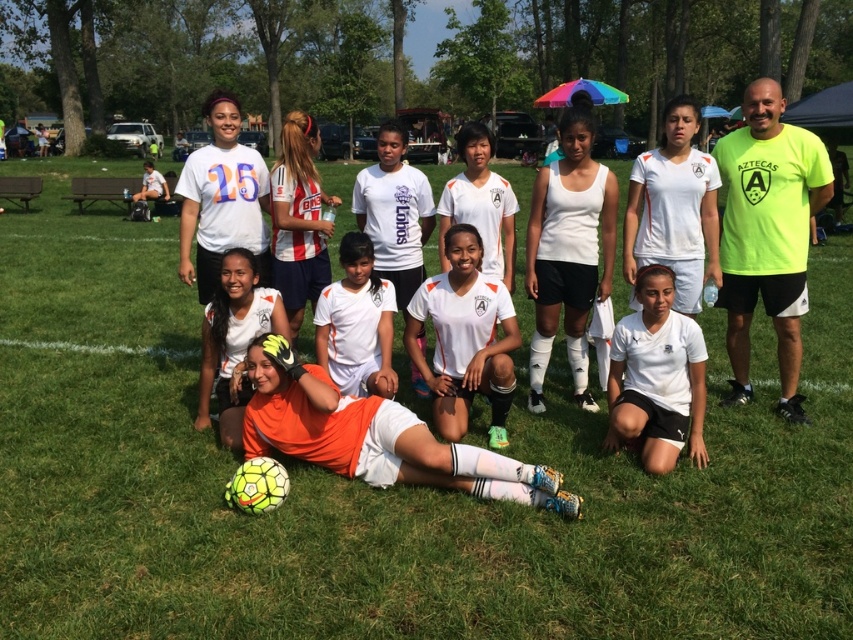
You are a photographer trying to capture a photo of the striped jersey at center and orange jersey at center. Which player should you focus on first if you want to capture them from left to right order?

You should focus on the orange jersey at center first because the striped jersey at center is to the right of it, so the orange jersey at center is on the left side.

You are a photographer trying to capture a clear shot of both the white matte uniform at center and the white matte soccer jersey at center. Since they are both at the center, how can you determine which one is taller?

The white matte uniform at center is taller than the white matte soccer jersey at center, so you can position your camera to focus on the taller white matte uniform at center first, then adjust to include the shorter white matte soccer jersey at center in the frame.

You are a photographer taking a team photo of the soccer players. You notice the striped jersey at center and the orange jersey at center. Which one is positioned higher in the image?

The striped jersey at center is positioned higher in the image than the orange jersey at center.